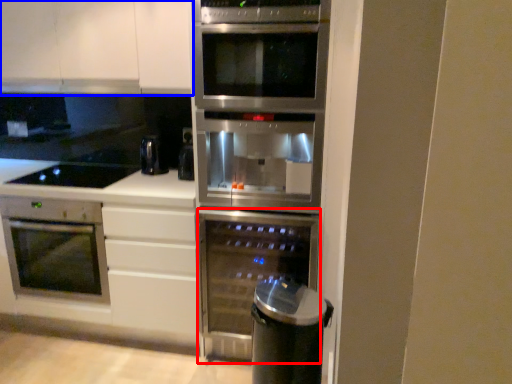
Question: Which object appears closest to the camera in this image, oven (highlighted by a red box) or cabinetry (highlighted by a blue box)?

Choices:
 (A) oven
 (B) cabinetry

Answer: (A)